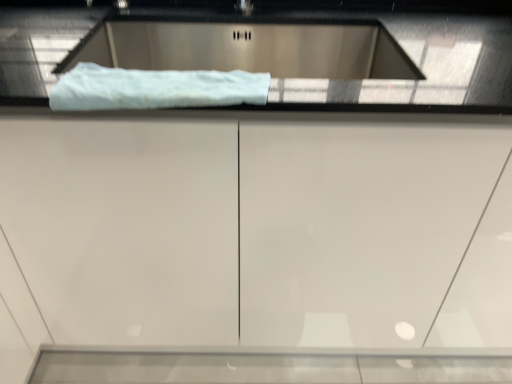
Question: Is white fluffy towel at upper center wider than satin silver sink at upper center?

Choices:
 (A) no
 (B) yes

Answer: (A)

Question: Is white fluffy towel at upper center directly adjacent to satin silver sink at upper center?

Choices:
 (A) yes
 (B) no

Answer: (B)

Question: Is white fluffy towel at upper center closer to the viewer compared to satin silver sink at upper center?

Choices:
 (A) yes
 (B) no

Answer: (A)

Question: From the image's perspective, would you say white fluffy towel at upper center is shown under satin silver sink at upper center?

Choices:
 (A) no
 (B) yes

Answer: (B)

Question: Are white fluffy towel at upper center and satin silver sink at upper center located far from each other?

Choices:
 (A) yes
 (B) no

Answer: (B)

Question: Considering the relative sizes of white fluffy towel at upper center and satin silver sink at upper center in the image provided, is white fluffy towel at upper center shorter than satin silver sink at upper center?

Choices:
 (A) no
 (B) yes

Answer: (B)

Question: Does satin silver sink at upper center have a larger size compared to white glossy cabinet at center?

Choices:
 (A) yes
 (B) no

Answer: (B)

Question: Considering the relative positions of satin silver sink at upper center and white glossy cabinet at center in the image provided, is satin silver sink at upper center to the left of white glossy cabinet at center from the viewer's perspective?

Choices:
 (A) no
 (B) yes

Answer: (B)

Question: Is the position of satin silver sink at upper center less distant than that of white glossy cabinet at center?

Choices:
 (A) no
 (B) yes

Answer: (A)

Question: Is satin silver sink at upper center not close to white glossy cabinet at center?

Choices:
 (A) yes
 (B) no

Answer: (B)

Question: Can white glossy cabinet at center be found inside satin silver sink at upper center?

Choices:
 (A) yes
 (B) no

Answer: (B)

Question: From a real-world perspective, is satin silver sink at upper center over white glossy cabinet at center?

Choices:
 (A) yes
 (B) no

Answer: (A)

Question: From the image's perspective, is white fluffy towel at upper center above white glossy cabinet at center?

Choices:
 (A) yes
 (B) no

Answer: (A)